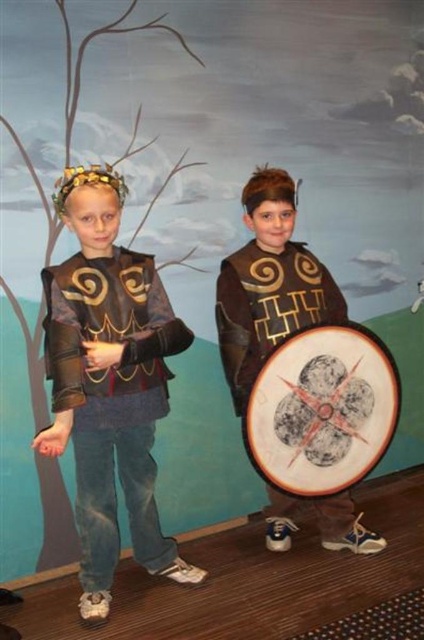
You are a knight in the scene and need to retrieve your shield. Which shield can you reach first without moving your feet, the wooden shield at right or the brown leather shield at center?

The wooden shield at right can be reached first because it is in front of the brown leather shield at center, making it closer to you.

You are a photographer trying to capture a closeup of the fantasy scene. You notice two points in the image at coordinates point (x=116, y=520) and point (x=346, y=486). Which point is closer to your camera lens?

Point (x=116, y=520) is further to the camera than point (x=346, y=486), so the closer point to the camera lens is point (x=346, y=486).

You are a costume designer trying to arrange two children in a photo shoot. The children are wearing costumes with matte black armor at left and another costume on the right. You want to ensure there is enough space between them for a camera to fit. If the camera requires at least 7 feet of space between them, will they need to move apart more?

The distance between the matte black armor at left and the other costume on the right is 6.80 feet. Since the camera requires at least 7 feet, they need to move apart slightly to accommodate the required space.